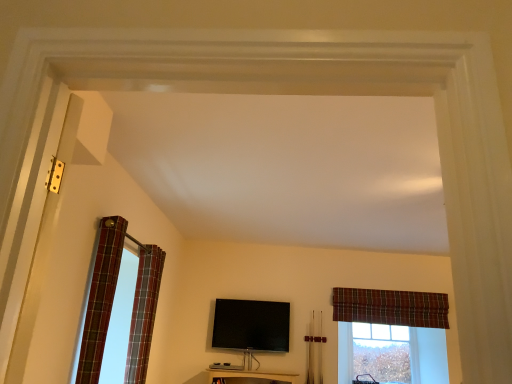
What do you see at coordinates (382, 352) in the screenshot? I see `clear glass window at center` at bounding box center [382, 352].

What is the approximate height of plaid fabric curtain at upper right, which is the 3th curtain from left to right?

plaid fabric curtain at upper right, which is the 3th curtain from left to right, is 16.66 inches in height.

The height and width of the screenshot is (384, 512). What are the coordinates of `black glossy flat-screen tv at center` in the screenshot? It's located at (251, 325).

Considering the sizes of plaid fabric curtain at left, acting as the 1th curtain starting from the left, and plaid fabric curtain at upper right, which is the 3th curtain from left to right, in the image, is plaid fabric curtain at left, acting as the 1th curtain starting from the left, bigger or smaller than plaid fabric curtain at upper right, which is the 3th curtain from left to right,?

Considering their sizes, plaid fabric curtain at left, acting as the 1th curtain starting from the left, takes up less space than plaid fabric curtain at upper right, which is the 3th curtain from left to right.

Is plaid fabric curtain at left, the 3th curtain from the right, not within plaid fabric curtain at upper right, the first curtain positioned from the back?

That's correct, plaid fabric curtain at left, the 3th curtain from the right, is outside of plaid fabric curtain at upper right, the first curtain positioned from the back.

Considering the sizes of objects plaid fabric curtain at left, the 3th curtain from the right, and plaid fabric curtain at upper right, the first curtain positioned from the back, in the image provided, who is thinner, plaid fabric curtain at left, the 3th curtain from the right, or plaid fabric curtain at upper right, the first curtain positioned from the back,?

Thinner between the two is plaid fabric curtain at upper right, the first curtain positioned from the back.

From the image's perspective, which object appears higher, plaid fabric curtain at left, the 3th curtain from the right, or plaid fabric curtain at upper right, which is the 3th curtain from left to right?

From the image's view, plaid fabric curtain at left, the 3th curtain from the right, is above.

The height and width of the screenshot is (384, 512). In order to click on television that is behind the plaid fabric curtain at left, which is the 1th curtain in front-to-back order in this screenshot , I will do `click(251, 325)`.

Which of these two, plaid fabric curtain at left, acting as the 1th curtain starting from the left, or black glossy flat-screen tv at center, stands taller?

plaid fabric curtain at left, acting as the 1th curtain starting from the left.

From the picture: From a real-world perspective, is plaid fabric curtain at left, which is the 1th curtain in front-to-back order, positioned under black glossy flat-screen tv at center based on gravity?

No, from a real-world perspective, plaid fabric curtain at left, which is the 1th curtain in front-to-back order, is not under black glossy flat-screen tv at center.

Considering the relative sizes of plaid fabric curtain at upper right, which is the 3th curtain from left to right, and clear glass window at center in the image provided, is plaid fabric curtain at upper right, which is the 3th curtain from left to right, taller than clear glass window at center?

Incorrect, the height of plaid fabric curtain at upper right, which is the 3th curtain from left to right, is not larger of that of clear glass window at center.

Is plaid fabric curtain at upper right, which is the 3th curtain in front-to-back order, completely or partially outside of clear glass window at center?

Yes, plaid fabric curtain at upper right, which is the 3th curtain in front-to-back order, is outside of clear glass window at center.

Considering their positions, is plaid fabric curtain at upper right, the first curtain positioned from the back, located in front of or behind clear glass window at center?

plaid fabric curtain at upper right, the first curtain positioned from the back, is in front of clear glass window at center.

Does plaid fabric curtain at upper right, which is the 3th curtain in front-to-back order, have a larger size compared to clear glass window at center?

Actually, plaid fabric curtain at upper right, which is the 3th curtain in front-to-back order, might be smaller than clear glass window at center.

From the picture: From a real-world perspective, which is physically below, plaid fabric curtain at left, acting as the 1th curtain starting from the left, or plaid fabric curtain at left, the 2th curtain from the front?

plaid fabric curtain at left, the 2th curtain from the front.

Is point (104, 232) closer to camera compared to point (144, 364)?

Yes, it is in front of point (144, 364).

Does plaid fabric curtain at left, arranged as the 3th curtain when viewed from the back, contain plaid fabric curtain at left, the 2th curtain from the front?

No, plaid fabric curtain at left, the 2th curtain from the front, is not surrounded by plaid fabric curtain at left, arranged as the 3th curtain when viewed from the back.

Is plaid fabric curtain at left, arranged as the 3th curtain when viewed from the back, looking in the opposite direction of plaid fabric curtain at left, the 2th curtain from the front?

No, plaid fabric curtain at left, the 2th curtain from the front, is not at the back of plaid fabric curtain at left, arranged as the 3th curtain when viewed from the back.

Which of these two, plaid fabric curtain at left, the 2th curtain from the front, or clear glass window at center, stands taller?

Standing taller between the two is plaid fabric curtain at left, the 2th curtain from the front.

At what (x,y) coordinates should I click in order to perform the action: click on curtain that is the 2nd one when counting leftward from the clear glass window at center. Please return your answer as a coordinate pair (x, y). The height and width of the screenshot is (384, 512). Looking at the image, I should click on (143, 313).

From a real-world perspective, which object rests below the other?

In real-world perspective, clear glass window at center is lower.

Is plaid fabric curtain at left, which is the 2th curtain from right to left, not inside clear glass window at center?

plaid fabric curtain at left, which is the 2th curtain from right to left, is positioned outside clear glass window at center.

Who is more distant, black glossy flat-screen tv at center or plaid fabric curtain at upper right, which ranks as the first curtain in right-to-left order?

plaid fabric curtain at upper right, which ranks as the first curtain in right-to-left order, is further away from the camera.

Is plaid fabric curtain at upper right, the first curtain positioned from the back, surrounded by black glossy flat-screen tv at center?

No, plaid fabric curtain at upper right, the first curtain positioned from the back, is not inside black glossy flat-screen tv at center.

Can you confirm if black glossy flat-screen tv at center is shorter than plaid fabric curtain at upper right, which is the 3th curtain from left to right?

No, black glossy flat-screen tv at center is not shorter than plaid fabric curtain at upper right, which is the 3th curtain from left to right.

Considering the sizes of objects black glossy flat-screen tv at center and plaid fabric curtain at upper right, which is the 3th curtain in front-to-back order, in the image provided, who is thinner, black glossy flat-screen tv at center or plaid fabric curtain at upper right, which is the 3th curtain in front-to-back order,?

Thinner between the two is plaid fabric curtain at upper right, which is the 3th curtain in front-to-back order.

Measure the distance between clear glass window at center and plaid fabric curtain at left, which is the 2th curtain from right to left.

They are 3.66 meters apart.

Is plaid fabric curtain at left, which is the 2th curtain in back-to-front order, inside clear glass window at center?

No.

From a real-world perspective, between clear glass window at center and plaid fabric curtain at left, the 2th curtain from the front, who is vertically higher?

In real-world perspective, plaid fabric curtain at left, the 2th curtain from the front, is above.

Considering the sizes of clear glass window at center and plaid fabric curtain at left, the 2th curtain from the front, in the image, is clear glass window at center bigger or smaller than plaid fabric curtain at left, the 2th curtain from the front,?

In the image, clear glass window at center appears to be smaller than plaid fabric curtain at left, the 2th curtain from the front.

Locate an element on the screen. The image size is (512, 384). the 2nd curtain behind when counting from the plaid fabric curtain at left, arranged as the 3th curtain when viewed from the back is located at coordinates coord(391,307).

In order to click on television below the plaid fabric curtain at left, arranged as the 3th curtain when viewed from the back (from a real-world perspective) in this screenshot , I will do `click(251, 325)`.

Based on their spatial positions, is black glossy flat-screen tv at center or plaid fabric curtain at left, which is the 1th curtain in front-to-back order, further from clear glass window at center?

Based on the image, plaid fabric curtain at left, which is the 1th curtain in front-to-back order, appears to be further to clear glass window at center.

Looking at the image, which one is located further to plaid fabric curtain at upper right, the first curtain positioned from the back, clear glass window at center or black glossy flat-screen tv at center?

black glossy flat-screen tv at center lies further to plaid fabric curtain at upper right, the first curtain positioned from the back, than the other object.

Looking at the image, which one is located closer to black glossy flat-screen tv at center, plaid fabric curtain at upper right, which is the 3th curtain in front-to-back order, or clear glass window at center?

plaid fabric curtain at upper right, which is the 3th curtain in front-to-back order, lies closer to black glossy flat-screen tv at center than the other object.

Considering their positions, is plaid fabric curtain at upper right, which ranks as the first curtain in right-to-left order, positioned closer to plaid fabric curtain at left, arranged as the 3th curtain when viewed from the back, than black glossy flat-screen tv at center?

black glossy flat-screen tv at center is closer to plaid fabric curtain at left, arranged as the 3th curtain when viewed from the back.

Looking at the image, which one is located closer to plaid fabric curtain at upper right, which is the 3th curtain from left to right, plaid fabric curtain at left, acting as the 1th curtain starting from the left, or plaid fabric curtain at left, which is the 2th curtain from right to left?

plaid fabric curtain at left, which is the 2th curtain from right to left, is closer to plaid fabric curtain at upper right, which is the 3th curtain from left to right.

Which object lies further to the anchor point plaid fabric curtain at left, the second curtain positioned from the left, plaid fabric curtain at left, acting as the 1th curtain starting from the left, or plaid fabric curtain at upper right, the first curtain positioned from the back?

plaid fabric curtain at upper right, the first curtain positioned from the back, lies further to plaid fabric curtain at left, the second curtain positioned from the left, than the other object.

Which object lies nearer to the anchor point plaid fabric curtain at upper right, which is the 3th curtain from left to right, plaid fabric curtain at left, acting as the 1th curtain starting from the left, or clear glass window at center?

clear glass window at center.

Considering their positions, is plaid fabric curtain at left, which is the 1th curtain in front-to-back order, positioned closer to plaid fabric curtain at upper right, the first curtain positioned from the back, than black glossy flat-screen tv at center?

black glossy flat-screen tv at center is positioned closer to the anchor plaid fabric curtain at upper right, the first curtain positioned from the back.

Locate an element on the screen. The width and height of the screenshot is (512, 384). curtain located between plaid fabric curtain at left, acting as the 1th curtain starting from the left, and plaid fabric curtain at upper right, the first curtain positioned from the back, in the left-right direction is located at coordinates (143, 313).

Where is `curtain between plaid fabric curtain at left, the 3th curtain from the right, and black glossy flat-screen tv at center in the front-back direction`? The height and width of the screenshot is (384, 512). curtain between plaid fabric curtain at left, the 3th curtain from the right, and black glossy flat-screen tv at center in the front-back direction is located at coordinates (143, 313).

Identify the location of curtain between plaid fabric curtain at left, which is the 2th curtain from right to left, and clear glass window at center. Image resolution: width=512 pixels, height=384 pixels. (391, 307).

Find the location of a particular element. This screenshot has width=512, height=384. curtain between black glossy flat-screen tv at center and clear glass window at center from left to right is located at coordinates (391, 307).